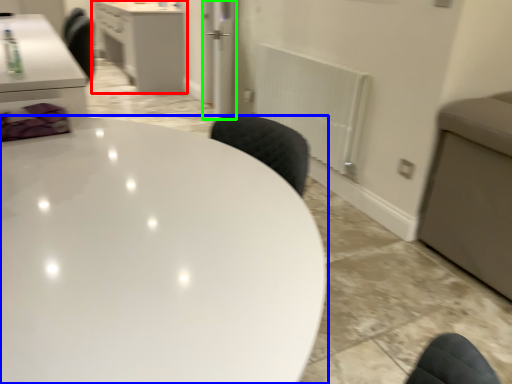
Question: Estimate the real-world distances between objects in this image. Which object is farther from cabinetry (highlighted by a red box), table (highlighted by a blue box) or glass door (highlighted by a green box)?

Choices:
 (A) table
 (B) glass door

Answer: (A)